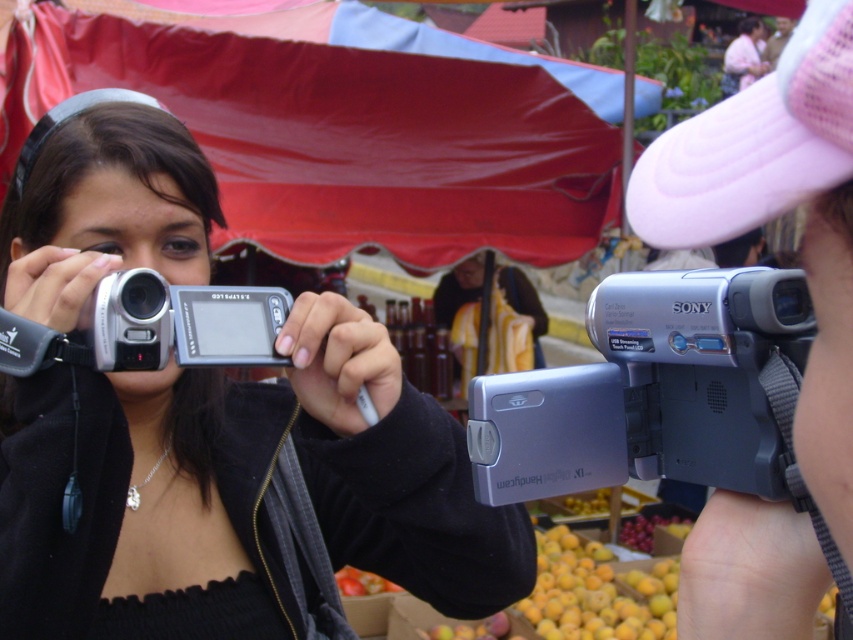
Question: Which point is closer to the camera?

Choices:
 (A) (412, 54)
 (B) (167, 320)

Answer: (B)

Question: Is red fabric canopy at upper center further to camera compared to silver metallic video camera at center?

Choices:
 (A) yes
 (B) no

Answer: (A)

Question: Is silver metallic camcorder at center closer to camera compared to silver metallic digital camera at center?

Choices:
 (A) no
 (B) yes

Answer: (B)

Question: Which point appears closest to the camera in this image?

Choices:
 (A) (556, 387)
 (B) (86, 49)
 (C) (386, 404)

Answer: (A)

Question: Considering the relative positions of silver metallic video camera at center and silver metallic digital camera at center in the image provided, where is silver metallic video camera at center located with respect to silver metallic digital camera at center?

Choices:
 (A) right
 (B) left

Answer: (A)

Question: Which of the following is the farthest from the observer?

Choices:
 (A) (531, 385)
 (B) (300, 176)

Answer: (B)